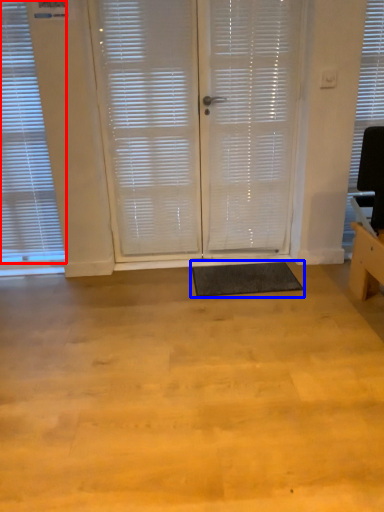
Question: Which point is closer to the camera, window blind (highlighted by a red box) or yoga mat (highlighted by a blue box)?

Choices:
 (A) window blind
 (B) yoga mat

Answer: (A)